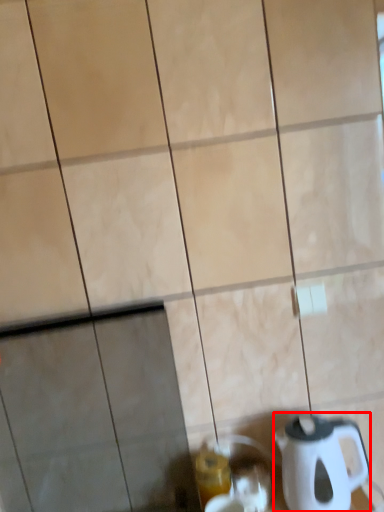
Question: From the image's perspective, what is the correct spatial positioning of kettle (annotated by the red box) in reference to beverage?

Choices:
 (A) above
 (B) below

Answer: (A)